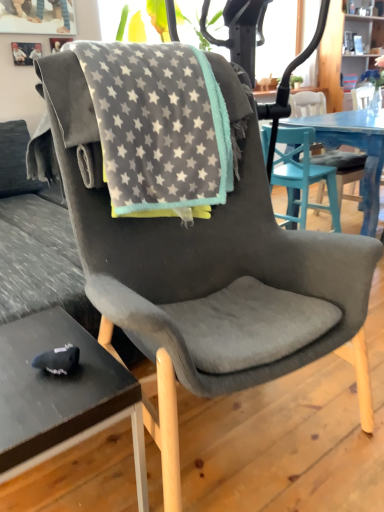
Question: Is gray fleece blanket at center aimed at black matte desk at lower left?

Choices:
 (A) yes
 (B) no

Answer: (B)

Question: Does gray fleece blanket at center come behind black matte desk at lower left?

Choices:
 (A) no
 (B) yes

Answer: (B)

Question: Can black matte desk at lower left be found inside gray fleece blanket at center?

Choices:
 (A) yes
 (B) no

Answer: (B)

Question: Is gray fleece blanket at center outside of black matte desk at lower left?

Choices:
 (A) yes
 (B) no

Answer: (A)

Question: Can you confirm if gray fleece blanket at center is thinner than black matte desk at lower left?

Choices:
 (A) no
 (B) yes

Answer: (A)

Question: Can you confirm if gray fleece blanket at center is wider than black matte desk at lower left?

Choices:
 (A) no
 (B) yes

Answer: (B)

Question: Can you confirm if suede gray chair at center is smaller than black matte desk at lower left?

Choices:
 (A) no
 (B) yes

Answer: (A)

Question: Is suede gray chair at center aimed at black matte desk at lower left?

Choices:
 (A) yes
 (B) no

Answer: (B)

Question: Is suede gray chair at center closer to camera compared to black matte desk at lower left?

Choices:
 (A) no
 (B) yes

Answer: (A)

Question: Does suede gray chair at center have a lesser width compared to black matte desk at lower left?

Choices:
 (A) no
 (B) yes

Answer: (A)

Question: Can you confirm if suede gray chair at center is taller than black matte desk at lower left?

Choices:
 (A) yes
 (B) no

Answer: (A)

Question: Can you confirm if suede gray chair at center is bigger than black matte desk at lower left?

Choices:
 (A) no
 (B) yes

Answer: (B)

Question: From a real-world perspective, is gray fleece blanket at center positioned over suede gray chair at center based on gravity?

Choices:
 (A) no
 (B) yes

Answer: (B)